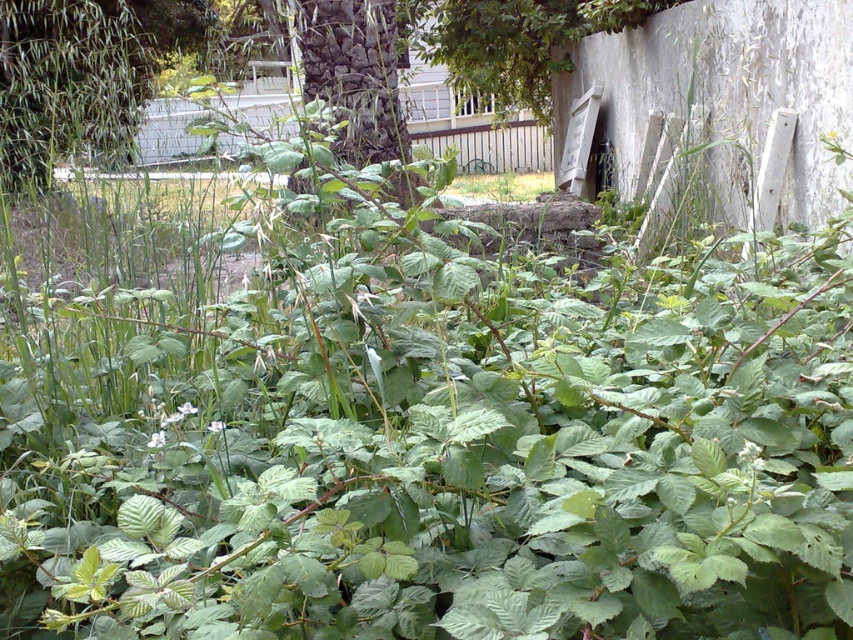
Question: Which point is closer to the camera?

Choices:
 (A) dark brown textured tree trunk at center
 (B) green leafy grass at center

Answer: (A)

Question: Can you confirm if dark brown textured tree trunk at center is bigger than green leafy grass at center?

Choices:
 (A) no
 (B) yes

Answer: (A)

Question: Can you confirm if dark brown textured tree trunk at center is smaller than green leafy grass at center?

Choices:
 (A) yes
 (B) no

Answer: (A)

Question: Where is dark brown textured tree trunk at center located in relation to green leafy grass at center in the image?

Choices:
 (A) above
 (B) below

Answer: (B)